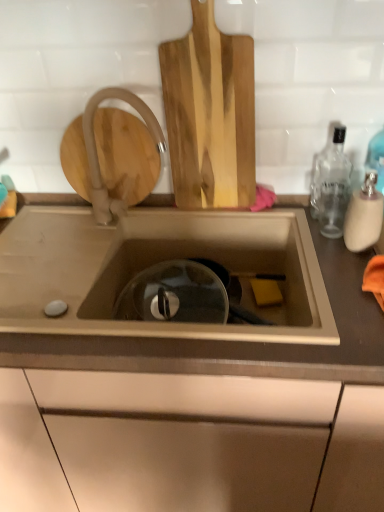
Question: From a real-world perspective, is translucent glass bottle at right, which appears as the second bottle when viewed from the back, located beneath clear glass bottle at right, acting as the 2th bottle starting from the front?

Choices:
 (A) yes
 (B) no

Answer: (A)

Question: Does translucent glass bottle at right, which appears as the second bottle when viewed from the back, have a greater height compared to clear glass bottle at right, the 1th bottle in the back-to-front sequence?

Choices:
 (A) no
 (B) yes

Answer: (A)

Question: Does translucent glass bottle at right, which appears as the second bottle when viewed from the back, have a larger size compared to clear glass bottle at right, acting as the 2th bottle starting from the front?

Choices:
 (A) no
 (B) yes

Answer: (A)

Question: Is translucent glass bottle at right, which appears as the second bottle when viewed from the back, thinner than clear glass bottle at right, acting as the 2th bottle starting from the front?

Choices:
 (A) no
 (B) yes

Answer: (A)

Question: Is translucent glass bottle at right, which ranks as the first bottle in front-to-back order, beside clear glass bottle at right, the 1th bottle in the back-to-front sequence?

Choices:
 (A) yes
 (B) no

Answer: (B)

Question: From a real-world perspective, relative to clear glass bottle at right, the 1th bottle in the back-to-front sequence, is natural wood cutting board at upper center vertically above or below?

Choices:
 (A) below
 (B) above

Answer: (B)

Question: Is natural wood cutting board at upper center taller or shorter than clear glass bottle at right, the 1th bottle in the back-to-front sequence?

Choices:
 (A) tall
 (B) short

Answer: (A)

Question: Is natural wood cutting board at upper center to the left or to the right of clear glass bottle at right, acting as the 2th bottle starting from the front, in the image?

Choices:
 (A) left
 (B) right

Answer: (A)

Question: Which is correct: natural wood cutting board at upper center is inside clear glass bottle at right, acting as the 2th bottle starting from the front, or outside of it?

Choices:
 (A) outside
 (B) inside

Answer: (A)

Question: In the image, is clear glass bottle at right, acting as the 2th bottle starting from the front, positioned in front of or behind natural wood cutting board at upper center?

Choices:
 (A) behind
 (B) front

Answer: (A)

Question: In the image, is clear glass bottle at right, acting as the 2th bottle starting from the front, on the left side or the right side of natural wood cutting board at upper center?

Choices:
 (A) right
 (B) left

Answer: (A)

Question: Is clear glass bottle at right, acting as the 2th bottle starting from the front, taller or shorter than natural wood cutting board at upper center?

Choices:
 (A) tall
 (B) short

Answer: (B)

Question: Considering the positions of point (322, 158) and point (223, 161), is point (322, 158) closer or farther from the camera than point (223, 161)?

Choices:
 (A) closer
 (B) farther

Answer: (B)

Question: From the image's perspective, is matte white faucet at upper left located above or below translucent glass bottle at right, which appears as the second bottle when viewed from the back?

Choices:
 (A) above
 (B) below

Answer: (A)

Question: In terms of size, does matte white faucet at upper left appear bigger or smaller than translucent glass bottle at right, which appears as the second bottle when viewed from the back?

Choices:
 (A) small
 (B) big

Answer: (B)